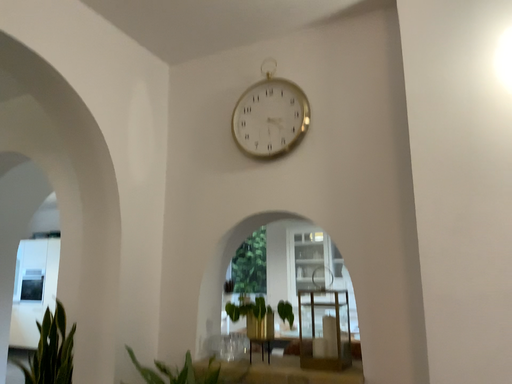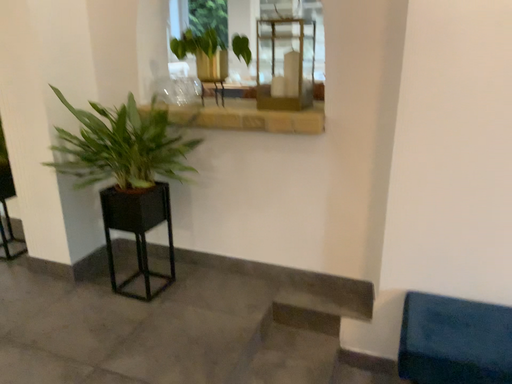
Question: Which way did the camera rotate in the video?

Choices:
 (A) rotated upward
 (B) rotated downward

Answer: (B)